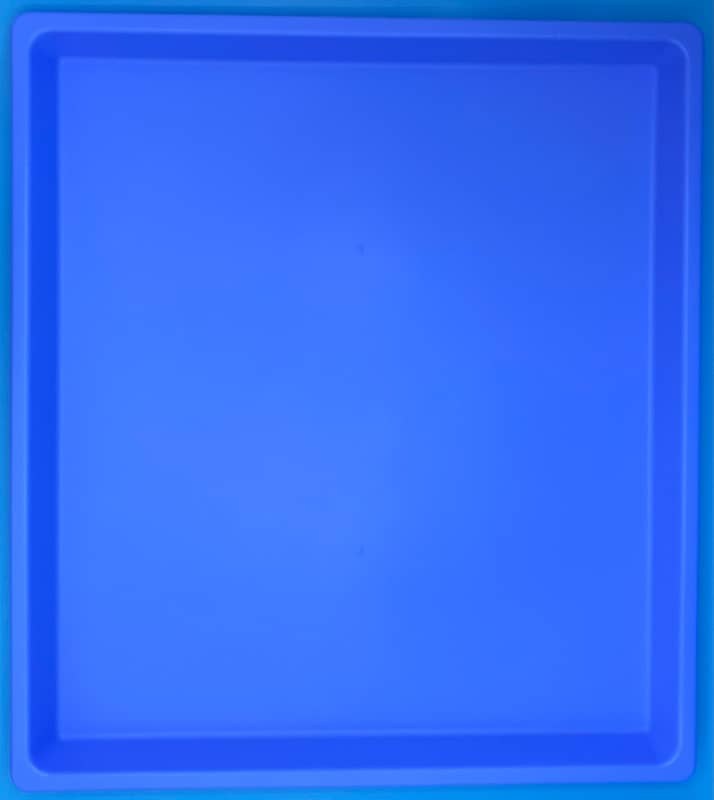
Where is `side of tray`? The image size is (714, 800). side of tray is located at coordinates (61, 390), (650, 388).